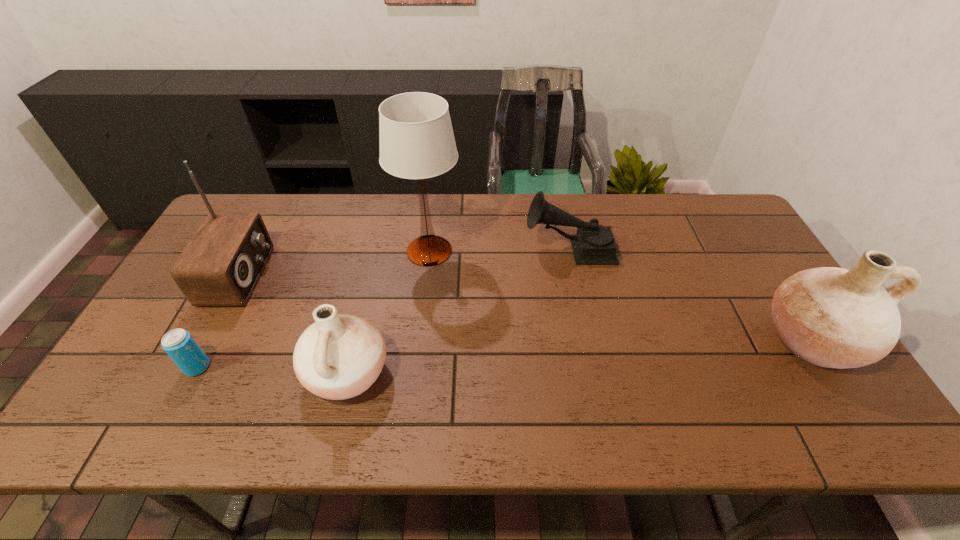
If equal spacing is desired by inserting an extra pottery among them, please point out a free spot for this new pottery. Please provide its 2D coordinates. Your answer should be formatted as a tuple, i.e. [(x, y)], where the tuple contains the x and y coordinates of a point satisfying the conditions above.

[(587, 356)]